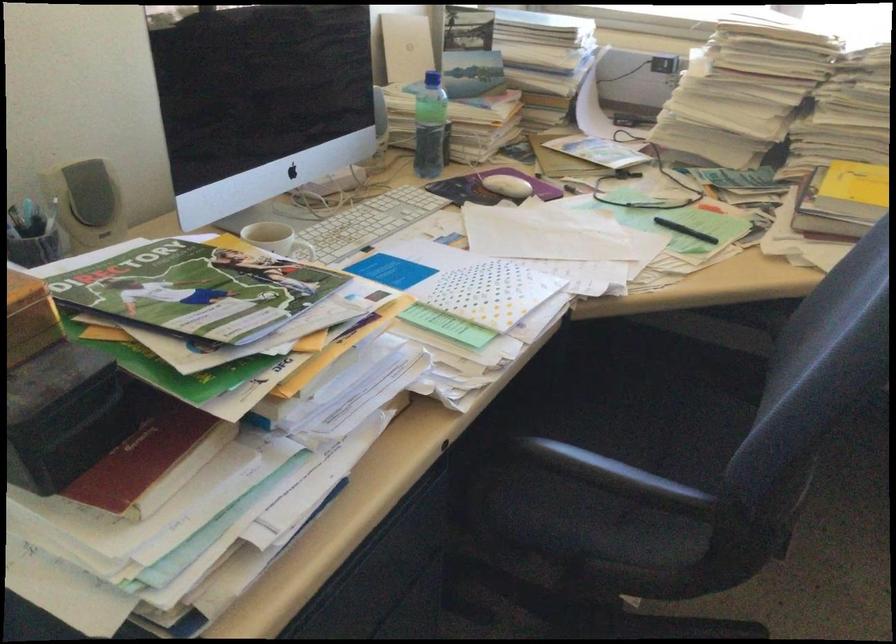
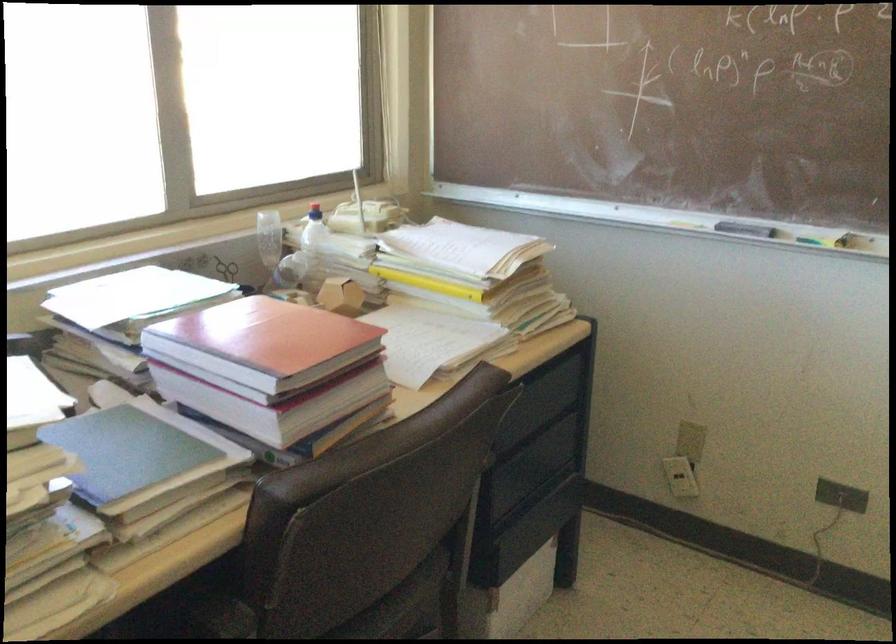
How did the camera likely rotate?

The rotation direction of the camera is right-down.